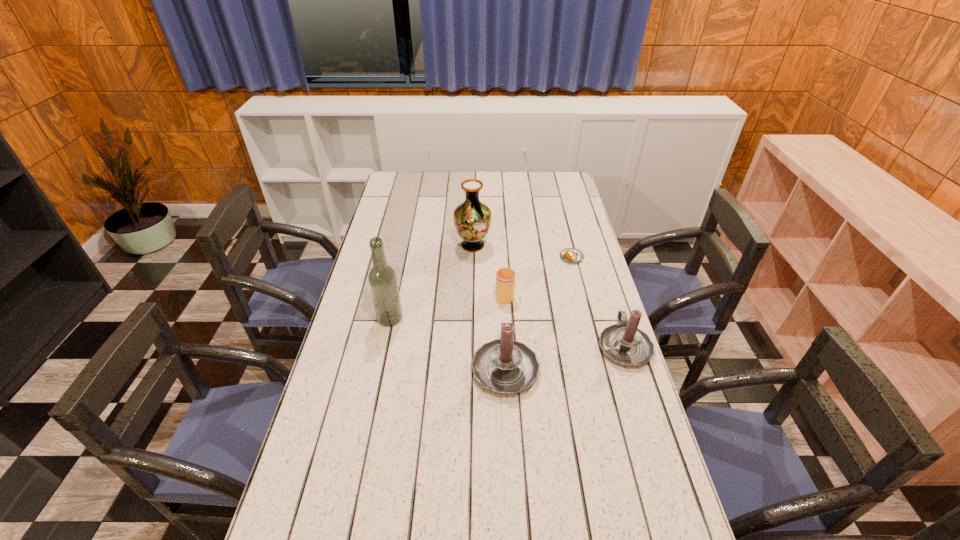
Locate an element on the screen. The height and width of the screenshot is (540, 960). vacant area situated 0.060m on the side of the left candle with the handle loop is located at coordinates (503, 325).

Find the location of a particular element. Image resolution: width=960 pixels, height=540 pixels. vacant space positioned on the side of the left candle with the handle loop is located at coordinates (502, 316).

This screenshot has height=540, width=960. Identify the location of blank space located on the side of the shorter candle with the handle loop. (609, 297).

At what (x,y) coordinates should I click in order to perform the action: click on free space located 0.320m on the side of the shorter candle with the handle loop. Please return your answer as a coordinate pair (x, y). Looking at the image, I should click on (598, 263).

I want to click on free region located 0.280m on the side of the shorter candle with the handle loop, so click(600, 269).

Image resolution: width=960 pixels, height=540 pixels. What are the coordinates of `vacant space located on the right of the fifth shortest object` in the screenshot? It's located at (583, 246).

At what (x,y) coordinates should I click in order to perform the action: click on free space located 0.140m on the front of the pastry. Please return your answer as a coordinate pair (x, y). This screenshot has width=960, height=540. Looking at the image, I should click on (580, 289).

At what (x,y) coordinates should I click in order to perform the action: click on vacant space located 0.150m on the side of the cup with the handle. Please return your answer as a coordinate pair (x, y). This screenshot has width=960, height=540. Looking at the image, I should click on (502, 260).

You are a GUI agent. You are given a task and a screenshot of the screen. Output one action in this format:
    pyautogui.click(x=<x>, y=<y>)
    Task: Click on the free region located 0.090m on the side of the cup with the handle
    
    Given the screenshot: What is the action you would take?
    pyautogui.click(x=503, y=270)

Locate an element on the screen. Image resolution: width=960 pixels, height=540 pixels. vacant area situated on the side of the cup with the handle is located at coordinates (502, 254).